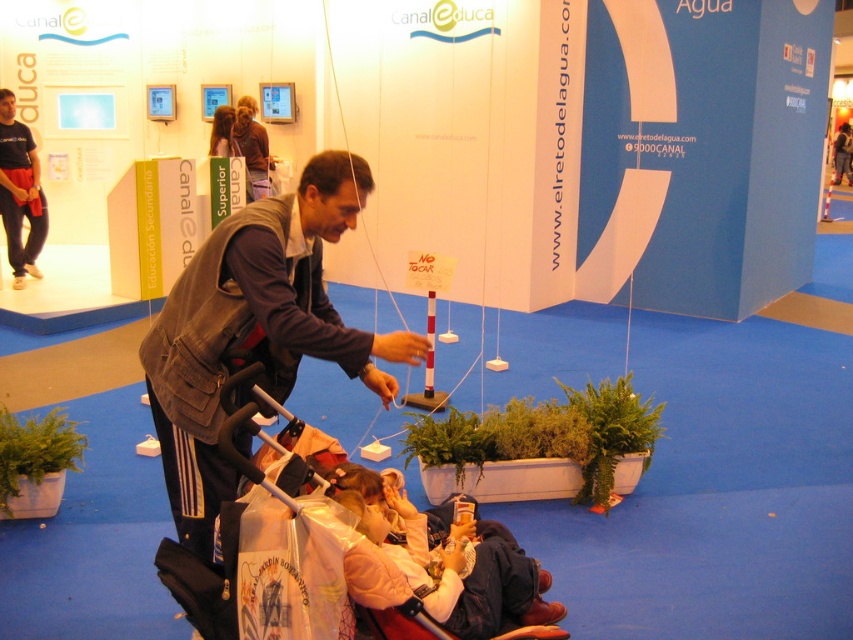
You are at an event and see a black plastic baby carriage at lower center and a light pink fabric at lower center. Which object is positioned to the left?

The black plastic baby carriage at lower center is to the left of the light pink fabric at lower center.

You are a photographer trying to capture a closeup of both the black plastic baby carriage at lower center and the light pink fabric at lower center in the scene. Given their current positions, can you fit both subjects into a single frame without moving either object? The camera has a maximum field of view that can cover 10 centimeters.

The black plastic baby carriage at lower center and light pink fabric at lower center are 8.51 centimeters apart from each other. Since the distance between them is less than the camera field of view of 10 centimeters, both subjects can be captured in a single frame without moving either object.